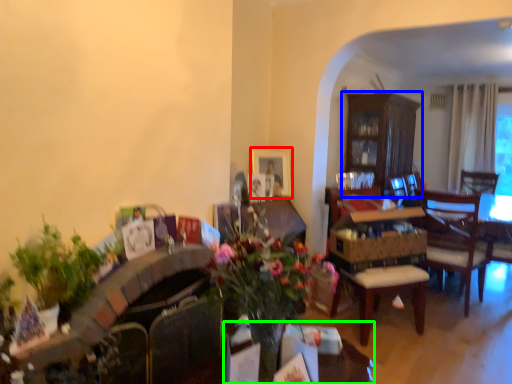
Question: Which object is positioned farthest from picture frame (highlighted by a red box)? Select from cabinetry (highlighted by a blue box) and table (highlighted by a green box).

Choices:
 (A) cabinetry
 (B) table

Answer: (A)